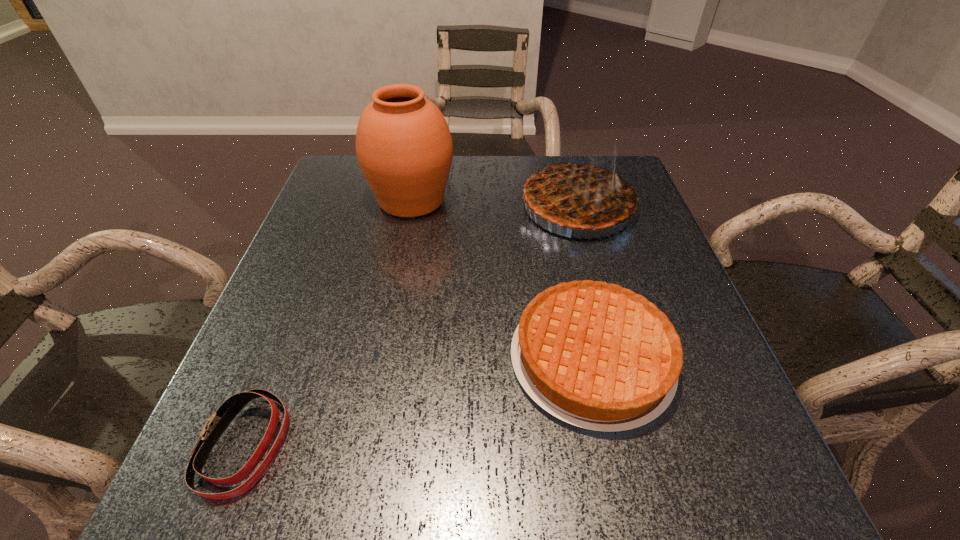
You are a GUI agent. You are given a task and a screenshot of the screen. Output one action in this format:
    pyautogui.click(x=<x>, y=<y>)
    Task: Click on the free region at the far edge
    This screenshot has height=540, width=960.
    Given the screenshot: What is the action you would take?
    pyautogui.click(x=480, y=163)

Where is `vacant space at the near edge`? vacant space at the near edge is located at coordinates (356, 462).

The height and width of the screenshot is (540, 960). I want to click on vacant region at the left edge of the desktop, so click(x=342, y=239).

The width and height of the screenshot is (960, 540). I want to click on vacant space at the right edge of the desktop, so click(x=657, y=231).

You are a GUI agent. You are given a task and a screenshot of the screen. Output one action in this format:
    pyautogui.click(x=<x>, y=<y>)
    Task: Click on the vacant space at the far left corner
    This screenshot has height=540, width=960.
    Given the screenshot: What is the action you would take?
    pyautogui.click(x=358, y=200)

The height and width of the screenshot is (540, 960). In the image, there is a desktop. Find the location of `vacant space at the near right corner`. vacant space at the near right corner is located at coordinates (738, 482).

The height and width of the screenshot is (540, 960). Identify the location of free space that is in between the leftmost object and the third object from right to left. (328, 322).

Find the location of a particular element. The image size is (960, 540). free area in between the shortest object and the taller pie is located at coordinates (411, 326).

You are a GUI agent. You are given a task and a screenshot of the screen. Output one action in this format:
    pyautogui.click(x=<x>, y=<y>)
    Task: Click on the free area in between the shortest object and the third shortest object
    The height and width of the screenshot is (540, 960).
    Given the screenshot: What is the action you would take?
    click(411, 326)

Where is `vacant region between the nearer pie and the leftmost object`? Image resolution: width=960 pixels, height=540 pixels. vacant region between the nearer pie and the leftmost object is located at coordinates (419, 402).